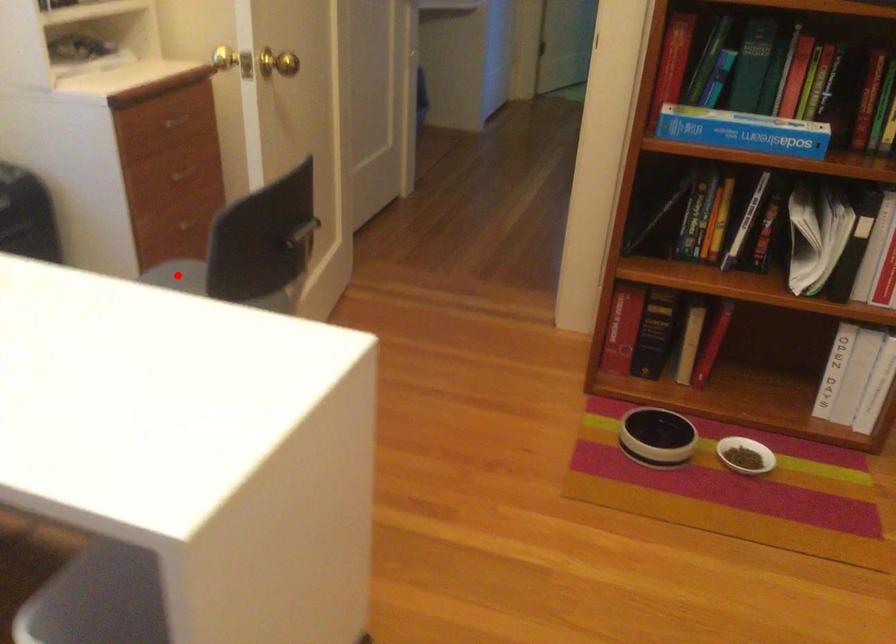
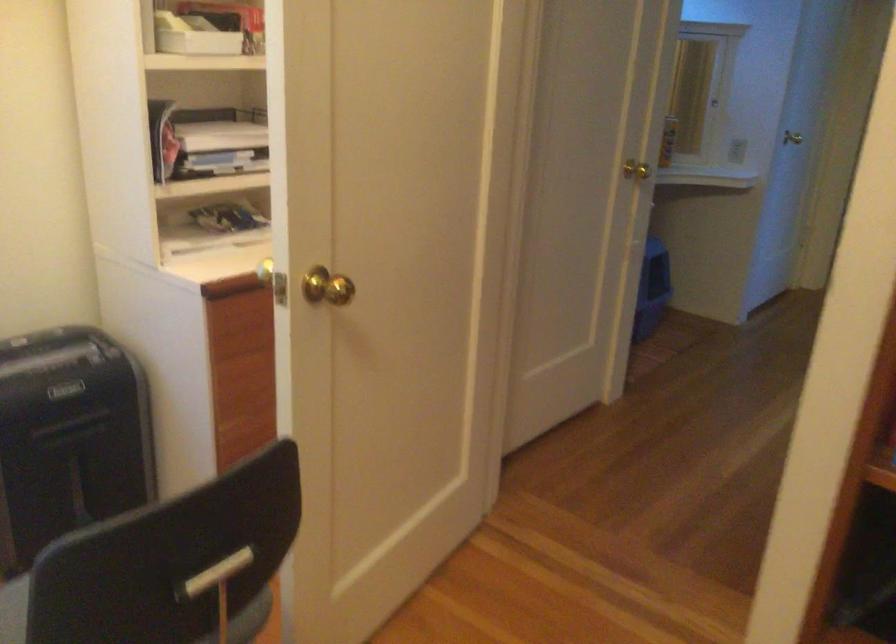
Question: I am providing you with two images of the same scene from different viewpoints. A red point is marked on the first image. Is the red point's position out of view in image 2?

Choices:
 (A) Yes
 (B) No

Answer: (A)